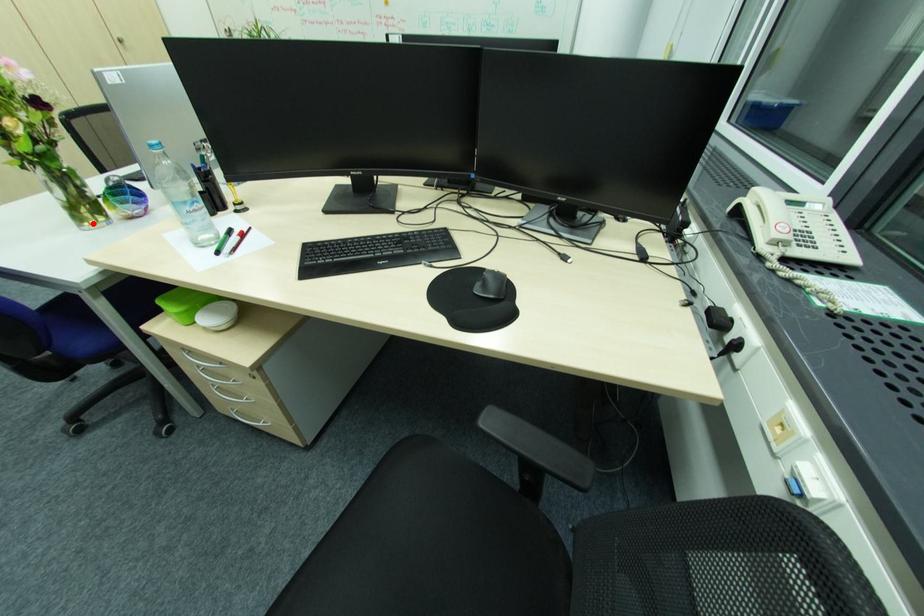
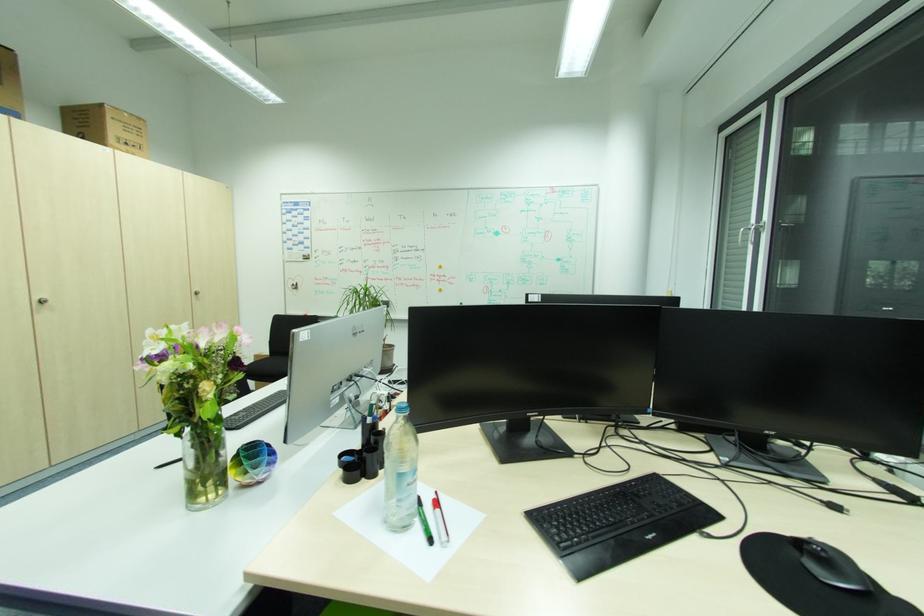
Locate, in the second image, the point that corresponds to the highlighted location in the first image.

(208, 500)